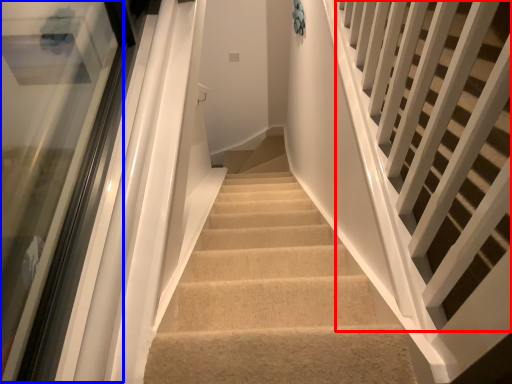
Question: Which object is closer to the camera taking this photo, stairs (highlighted by a red box) or glass door (highlighted by a blue box)?

Choices:
 (A) stairs
 (B) glass door

Answer: (A)